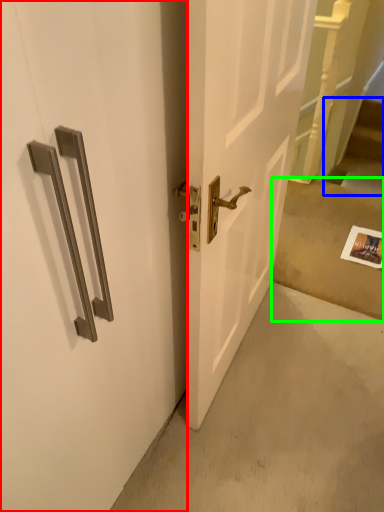
Question: Which is farther away from door (highlighted by a red box)? stairwell (highlighted by a blue box) or concrete (highlighted by a green box)?

Choices:
 (A) stairwell
 (B) concrete

Answer: (A)